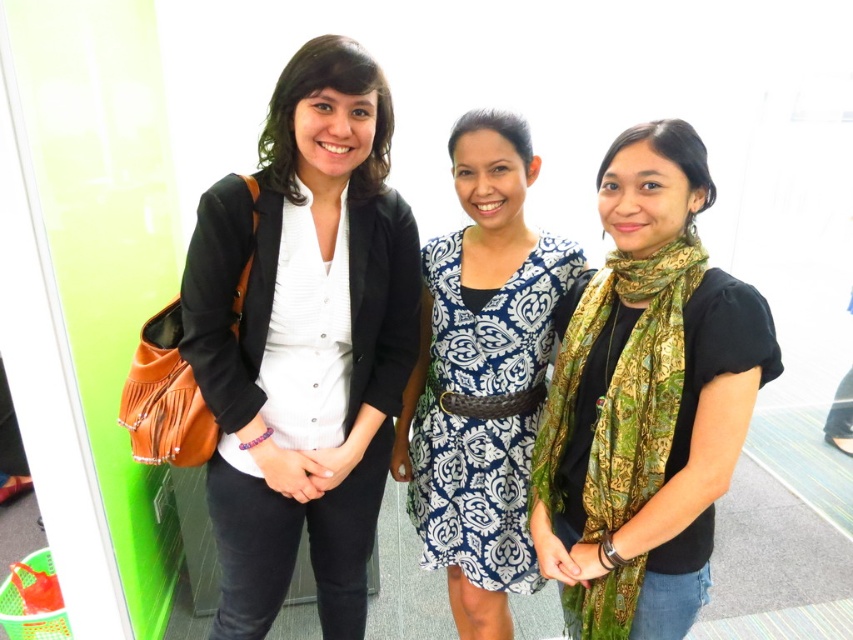
Question: Which object appears farthest from the camera in this image?

Choices:
 (A) matte black blazer at center
 (B) green silk scarf at center

Answer: (A)

Question: Observing the image, what is the correct spatial positioning of blue printed fabric dress at center in reference to green silk scarf at center?

Choices:
 (A) above
 (B) below

Answer: (A)

Question: Among these points, which one is farthest from the camera?

Choices:
 (A) tap(671, 369)
 (B) tap(206, 312)
 (C) tap(555, 260)

Answer: (C)

Question: Is matte black blazer at center in front of blue printed fabric dress at center?

Choices:
 (A) yes
 (B) no

Answer: (A)

Question: Which object appears farthest from the camera in this image?

Choices:
 (A) matte black blazer at center
 (B) blue printed fabric dress at center

Answer: (B)

Question: In this image, where is matte black blazer at center located relative to green silk scarf at center?

Choices:
 (A) left
 (B) right

Answer: (A)